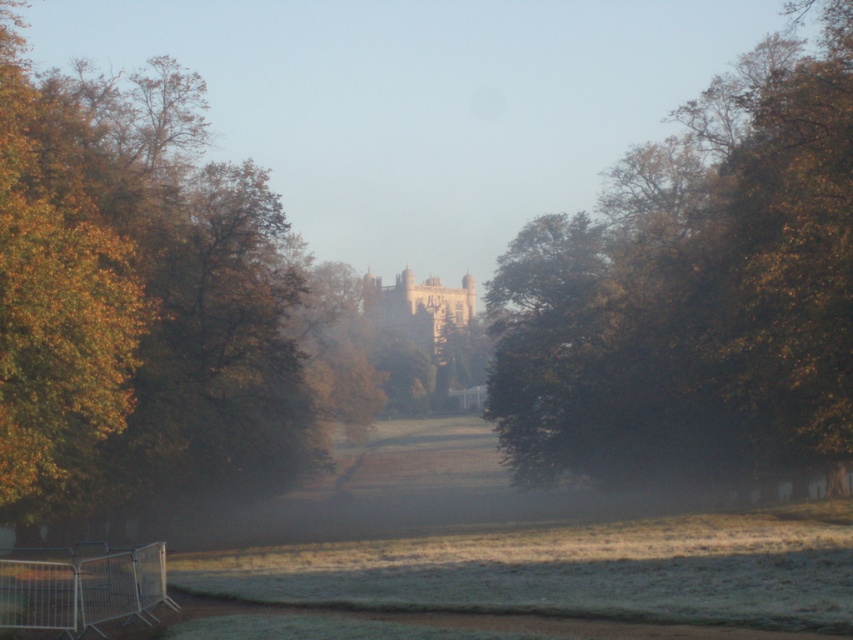
You are standing in the misty landscape looking towards the historic castle. You notice two points marked in the scene. Which point, point (111, 109) or point (616, 300), is closer to you?

Point (111, 109) is closer to the viewer than point (616, 300).

You are a visitor to the castle grounds and want to take a photo that includes both the golden leafy tree at center and the green leafy tree at center. Since you want both trees to be clearly visible in your photo, which tree should you position closer to the camera to ensure they appear similar in size?

The golden leafy tree at center is larger in size compared to the green leafy tree at center. To make them appear similar in size in the photo, you should position the smaller green leafy tree at center closer to the camera while keeping the larger golden leafy tree at center farther away.

You are standing at the point marked as point [138,305] in the image. What object is exactly at your current location?

The golden leafy tree at center is exactly at point [138,305].